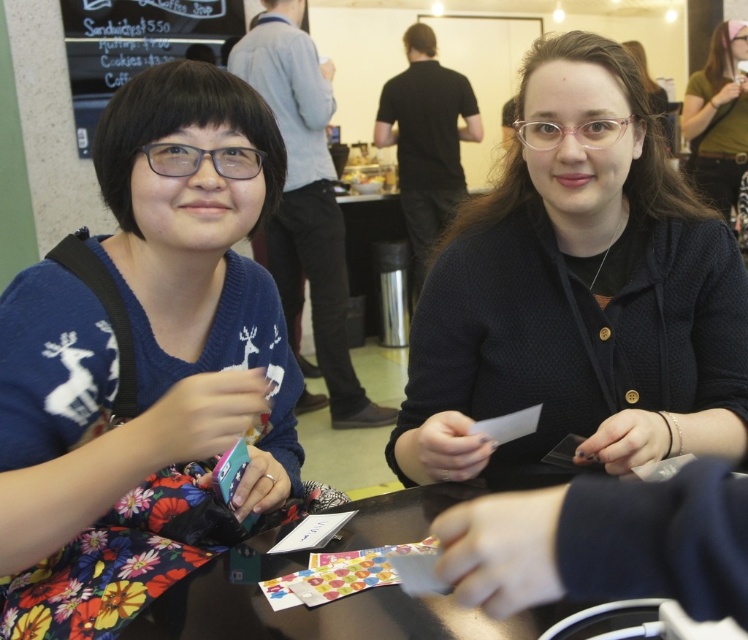
Question: Which of the following is the closest to the observer?

Choices:
 (A) (319, 561)
 (B) (693, 156)
 (C) (272, 138)

Answer: (A)

Question: Does colorful paper cards at center lie in front of white paper at center?

Choices:
 (A) yes
 (B) no

Answer: (A)

Question: Based on their relative distances, which object is nearer to the colorful paper cards at center?

Choices:
 (A) white paper at center
 (B) green matte shirt at upper right
 (C) matte black cardigan at center

Answer: (A)

Question: From the image, what is the correct spatial relationship of matte black cardigan at center in relation to white paper at center?

Choices:
 (A) below
 (B) above

Answer: (B)

Question: Which is nearer to the green matte shirt at upper right?

Choices:
 (A) matte black cardigan at center
 (B) blue sweater at left

Answer: (A)

Question: Can you confirm if colorful paper cards at center is positioned to the left of white paper at center?

Choices:
 (A) yes
 (B) no

Answer: (B)